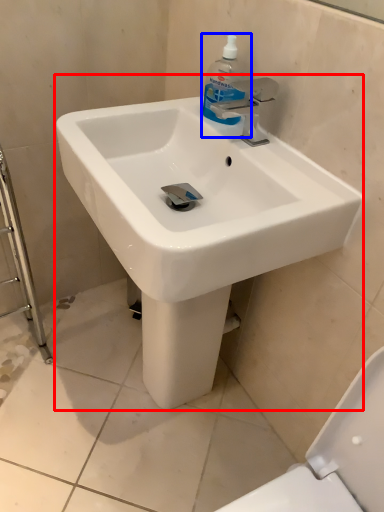
Question: Which object appears farthest to the camera in this image, sink (highlighted by a red box) or cleaning product (highlighted by a blue box)?

Choices:
 (A) sink
 (B) cleaning product

Answer: (B)